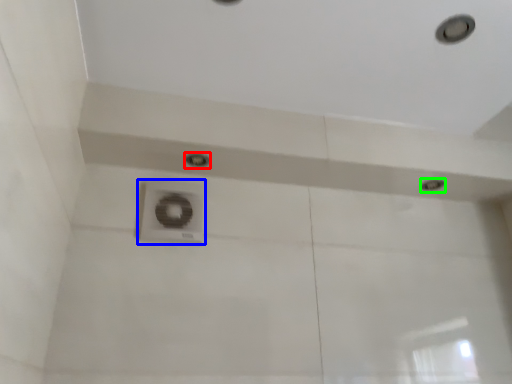
Question: Based on their relative distances, which object is farther from droplight (highlighted by a red box)? Choose from plumbing fixture (highlighted by a blue box) and droplight (highlighted by a green box).

Choices:
 (A) plumbing fixture
 (B) droplight

Answer: (B)